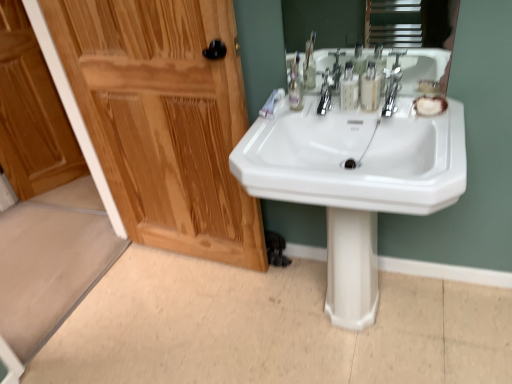
What are the coordinates of `free point below white glossy sink at center (from a real-world perspective)` in the screenshot? It's located at (345, 331).